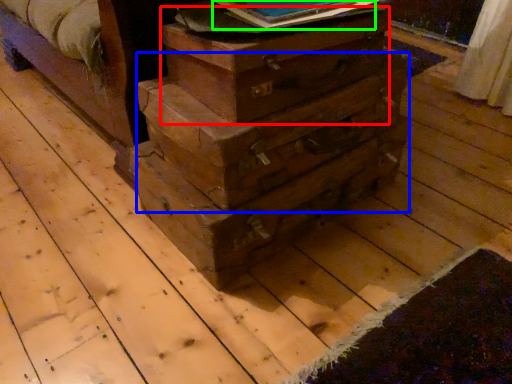
Question: Which object is positioned farthest from crate (highlighted by a red box)? Select from drawer (highlighted by a blue box) and paperback book (highlighted by a green box).

Choices:
 (A) drawer
 (B) paperback book

Answer: (B)